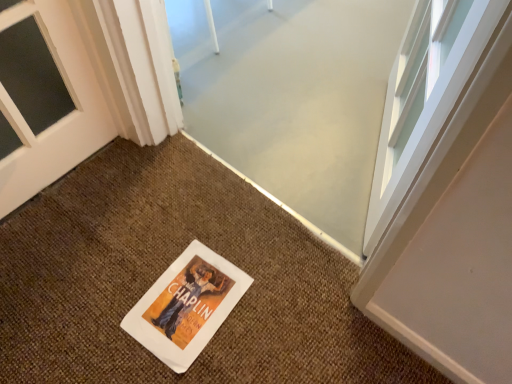
Locate an element on the screen. The height and width of the screenshot is (384, 512). vacant position to the left of white paper flyer at center is located at coordinates (101, 296).